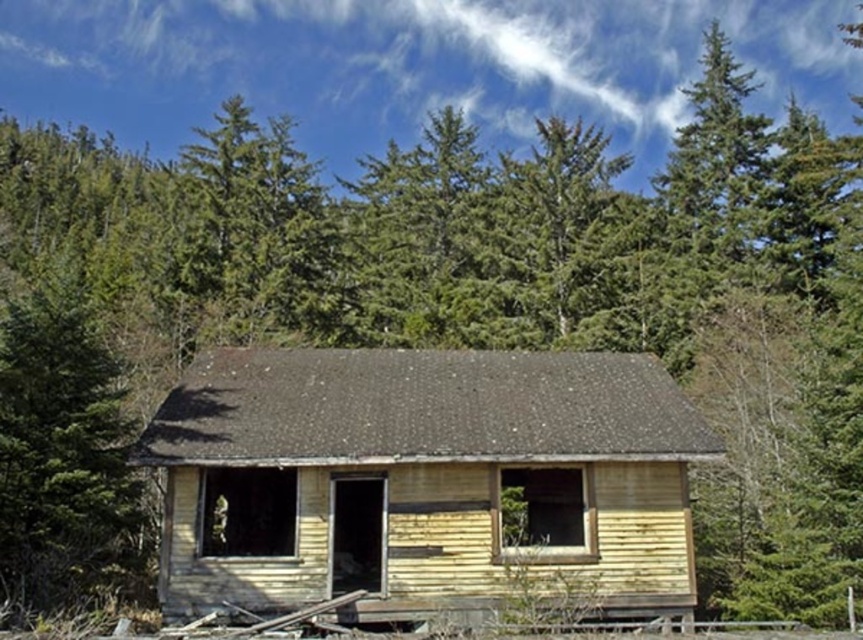
Question: Which point is closer to the camera taking this photo?

Choices:
 (A) click(425, 445)
 (B) click(11, 356)

Answer: (B)

Question: Is yellow wood cabin at center smaller than green textured tree at left?

Choices:
 (A) yes
 (B) no

Answer: (A)

Question: Does yellow wood cabin at center appear on the left side of green textured tree at left?

Choices:
 (A) yes
 (B) no

Answer: (B)

Question: Can you confirm if yellow wood cabin at center is positioned to the left of green textured tree at left?

Choices:
 (A) no
 (B) yes

Answer: (A)

Question: Which of the following is the closest to the observer?

Choices:
 (A) green textured tree at left
 (B) yellow wood cabin at center

Answer: (A)

Question: Among these points, which one is nearest to the camera?

Choices:
 (A) (309, 371)
 (B) (43, 339)

Answer: (B)